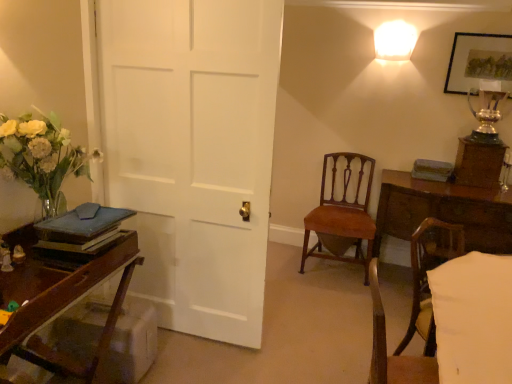
Find the location of a particular element. The width and height of the screenshot is (512, 384). vacant area in front of mahogany wood chair at center, placed as the second chair when sorted from front to back is located at coordinates (330, 299).